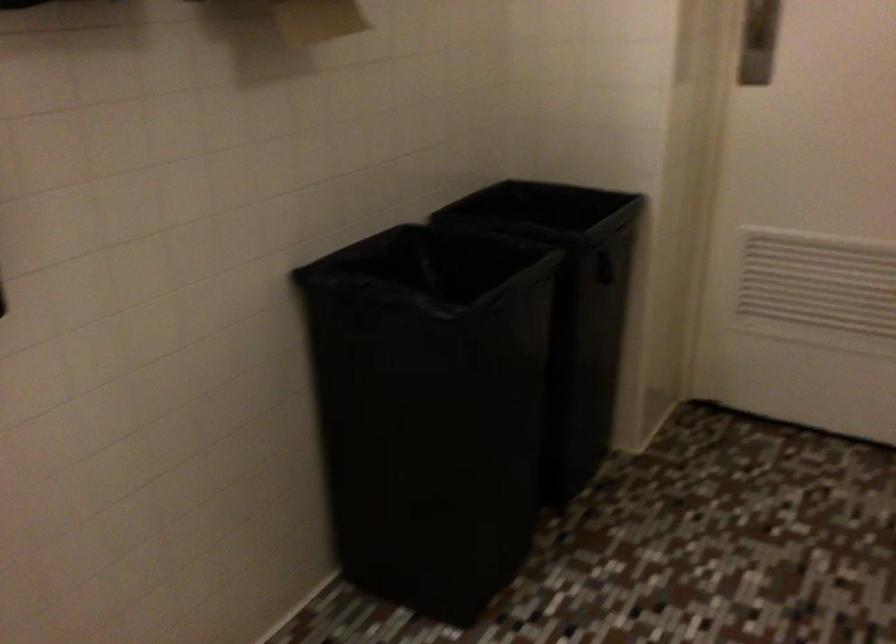
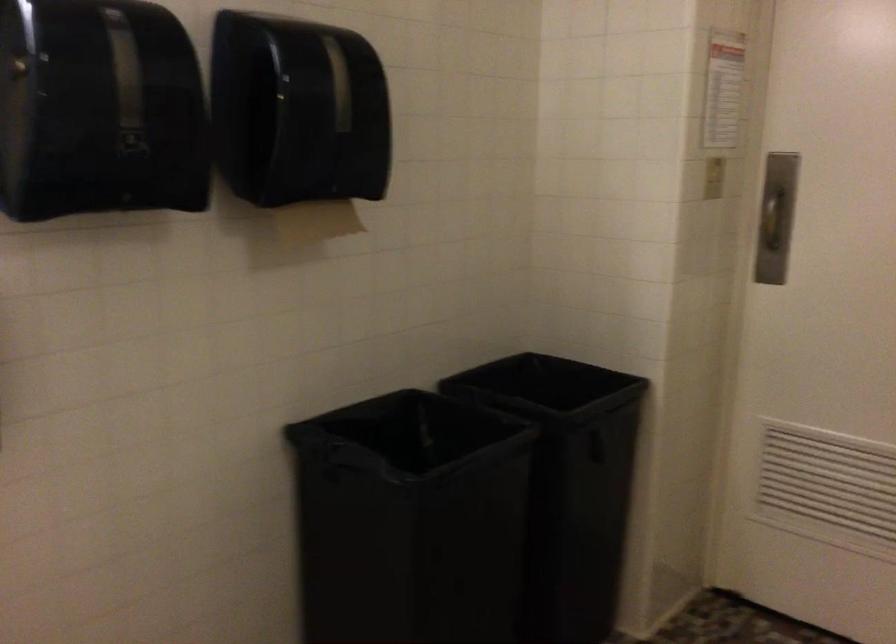
The point at (x=641, y=256) is marked in the first image. Where is the corresponding point in the second image?

(647, 438)